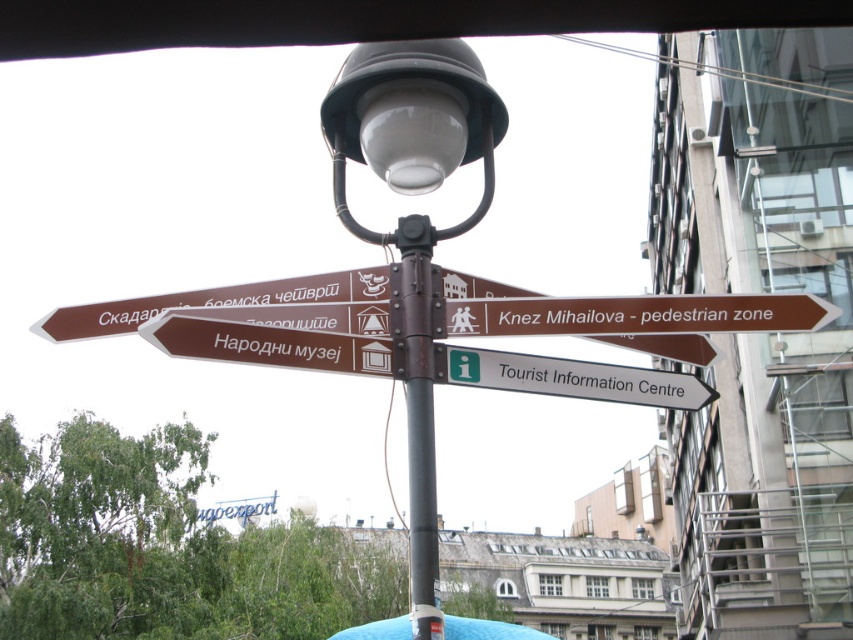
What is the spatial relationship between the matte black lamp post at center and the brown metallic pole at center in the scene?

The matte black lamp post at center is to the right of the brown metallic pole at center.

In the scene shown: You are standing at the point marked by the coordinates (415, 227). Which direction should you walk to reach the Tourist Information Centre?

The Tourist Information Centre is located below the topmost sign on the signpost at the coordinates (415, 227). Since you are already at the lamp post, you should follow the direction indicated by the sign pointing towards the Tourist Information Centre.

You are standing at the coordinates 0.5, 0.5. Can you see the matte black lamp post at center from your current position?

Yes, because the matte black lamp post at center is located at point (415, 227), which is close to your position at (426, 320), so it should be visible.